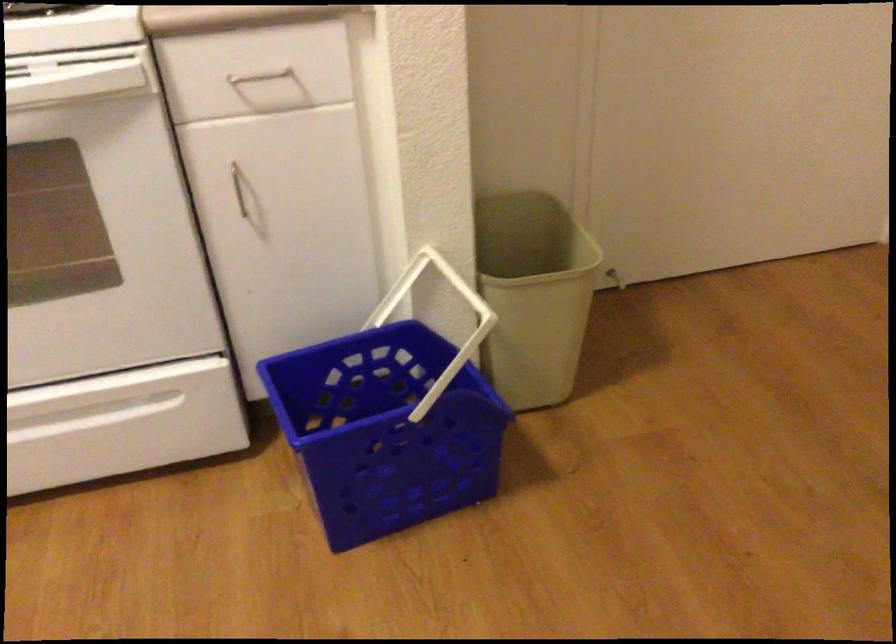
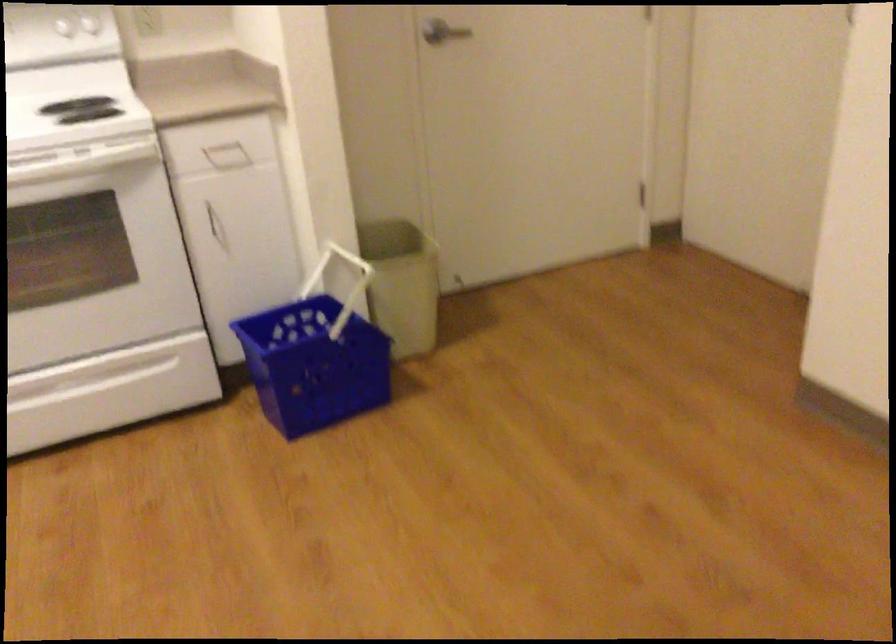
Question: Which direction would the cameraman need to move to produce the second image? Reply with the corresponding letter.

Choices:
 (A) Left
 (B) Right
 (C) Forward
 (D) Backward

Answer: (D)